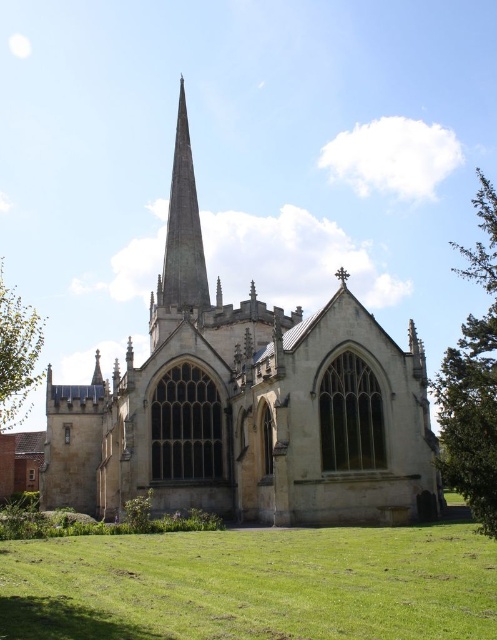
Question: Based on their relative distances, which object is farther from the green copper spire at center?

Choices:
 (A) green grass at lower center
 (B) green leafy tree at right
 (C) yellow stone church at center

Answer: (A)

Question: Can you confirm if yellow stone church at center is bigger than green copper spire at center?

Choices:
 (A) no
 (B) yes

Answer: (B)

Question: Estimate the real-world distances between objects in this image. Which object is farther from the green leafy tree at right?

Choices:
 (A) green copper spire at center
 (B) green leafy tree at lower left
 (C) green grass at lower center

Answer: (B)

Question: Which point is closer to the camera?

Choices:
 (A) (248, 602)
 (B) (29, 358)
 (C) (280, 358)
 (D) (169, 253)

Answer: (A)

Question: Is yellow stone church at center smaller than green leafy tree at lower left?

Choices:
 (A) no
 (B) yes

Answer: (A)

Question: Does green leafy tree at right come in front of green copper spire at center?

Choices:
 (A) no
 (B) yes

Answer: (B)